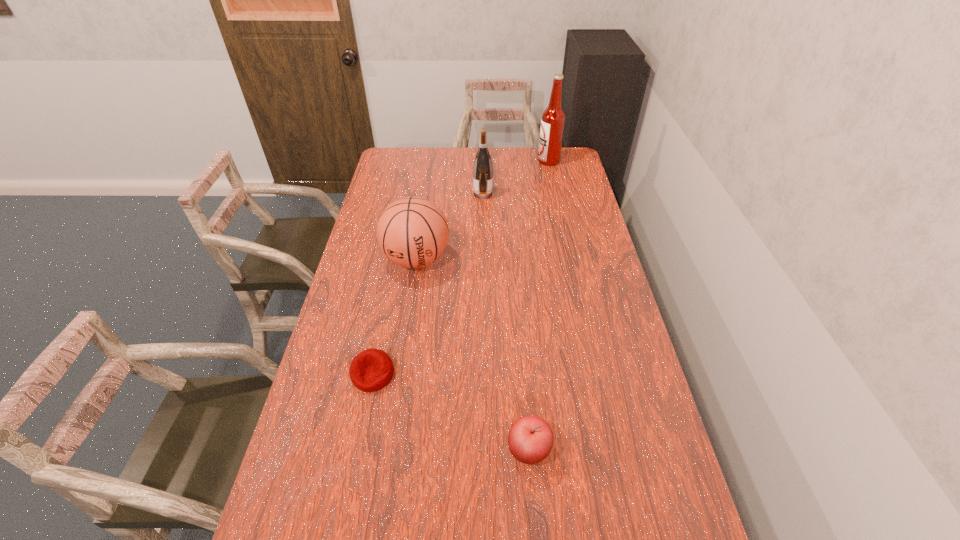
Image resolution: width=960 pixels, height=540 pixels. Identify the location of vacant space that's between the farthest object and the third object from right to left. (516, 178).

Locate an element on the screen. blank region between the wine bottle and the rightmost object is located at coordinates (516, 178).

Locate an element on the screen. The height and width of the screenshot is (540, 960). object that stands as the third closest to the third nearest object is located at coordinates (530, 440).

At what (x,y) coordinates should I click in order to perform the action: click on the second closest object relative to the beanbag. Please return your answer as a coordinate pair (x, y). This screenshot has height=540, width=960. Looking at the image, I should click on (530, 440).

This screenshot has width=960, height=540. I want to click on vacant position in the image that satisfies the following two spatial constraints: 1. on the label of the third object from right to left; 2. on the seat area of the beanbag, so click(x=485, y=374).

Where is `blank space that satisfies the following two spatial constraints: 1. on the label of the wine bottle; 2. on the surface of the third shortest object near the brand logo`? The width and height of the screenshot is (960, 540). blank space that satisfies the following two spatial constraints: 1. on the label of the wine bottle; 2. on the surface of the third shortest object near the brand logo is located at coordinates (484, 259).

Image resolution: width=960 pixels, height=540 pixels. I want to click on vacant space that satisfies the following two spatial constraints: 1. on the label side of the alcohol; 2. on the front side of the second shortest object, so click(x=612, y=450).

At what (x,y) coordinates should I click in order to perform the action: click on blank space that satisfies the following two spatial constraints: 1. on the label side of the alcohol; 2. on the surface of the third shortest object near the brand logo. Please return your answer as a coordinate pair (x, y). The width and height of the screenshot is (960, 540). Looking at the image, I should click on (570, 259).

Locate an element on the screen. This screenshot has width=960, height=540. vacant space that satisfies the following two spatial constraints: 1. on the label of the third object from right to left; 2. on the left side of the fourth object from left to right is located at coordinates (485, 450).